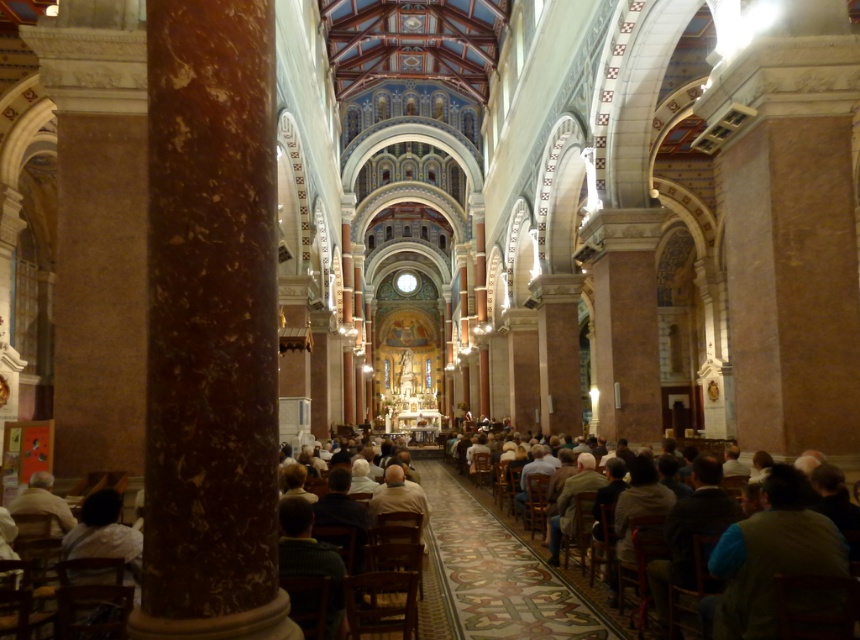
Question: Is dark brown leather chair at center positioned at the back of light brown leather jacket at lower left?

Choices:
 (A) yes
 (B) no

Answer: (B)

Question: Among these objects, which one is farthest from the camera?

Choices:
 (A) light brown leather jacket at lower left
 (B) dark brown leather chair at center
 (C) brown marble column at left

Answer: (A)

Question: Is brown marble column at left wider than light brown leather jacket at lower left?

Choices:
 (A) yes
 (B) no

Answer: (A)

Question: Is brown marble column at left positioned before light brown leather jacket at lower left?

Choices:
 (A) yes
 (B) no

Answer: (A)

Question: Which point is farther to the camera?

Choices:
 (A) (15, 509)
 (B) (237, 397)

Answer: (A)

Question: Which of the following is the farthest from the observer?

Choices:
 (A) dark brown leather chair at center
 (B) light brown leather jacket at lower left

Answer: (B)